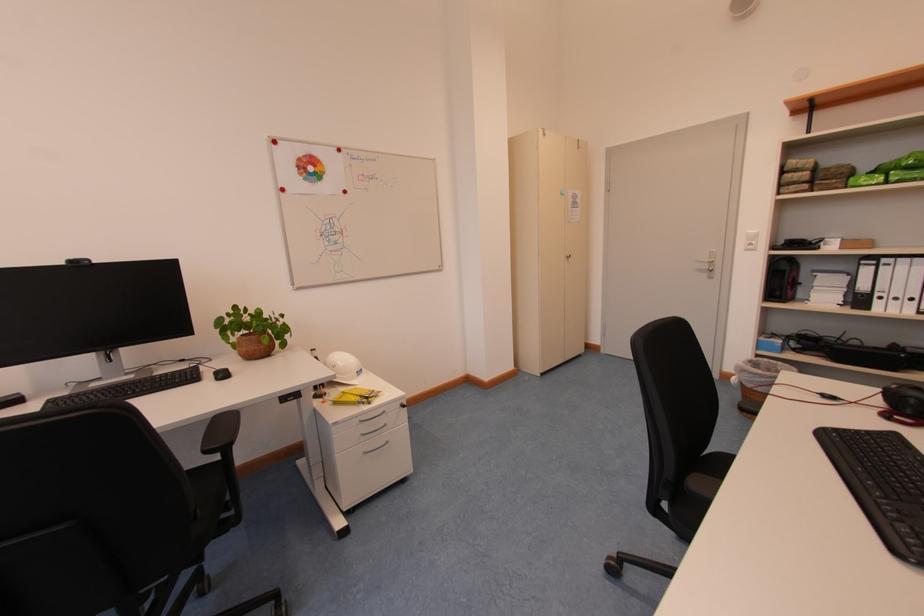
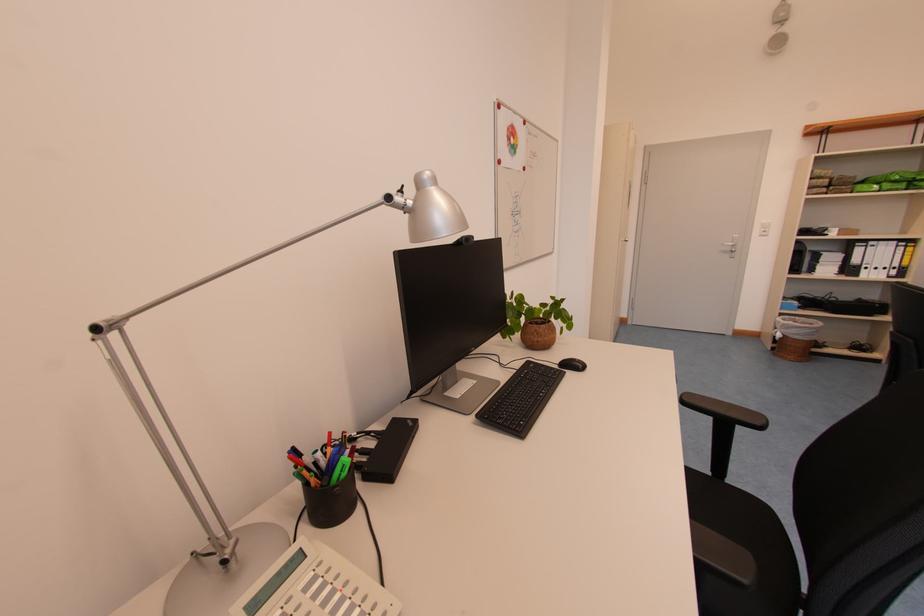
Where in the second image is the point corresponding to the point at 870,265 from the first image?

(865, 246)